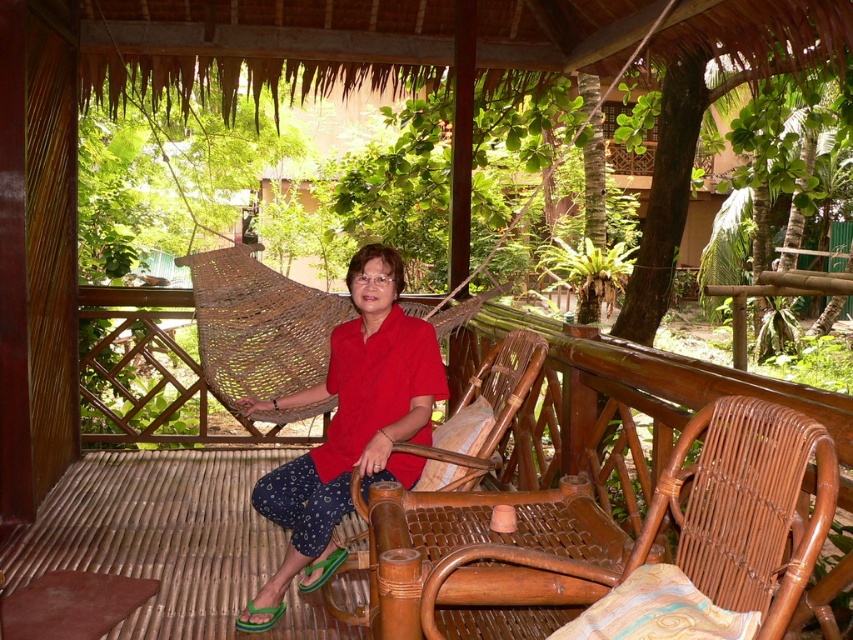
You are a photographer trying to capture the red matte shirt at center and the woven bamboo chair at center in the same frame. Based on their sizes, which object should you focus on first to ensure both are in focus?

The red matte shirt at center is taller than the woven bamboo chair at center, so focusing on the red matte shirt at center first would help ensure both are in focus since it is larger and likely closer to the camera.

You are planning to place a small side table between the brown wicker rocking chair at center and the woven bamboo chair at center. Based on their widths, which chair should the table be placed closer to?

The brown wicker rocking chair at center might be wider than the woven bamboo chair at center, so the table should be placed closer to the woven bamboo chair at center to ensure enough space around the wider rocking chair.